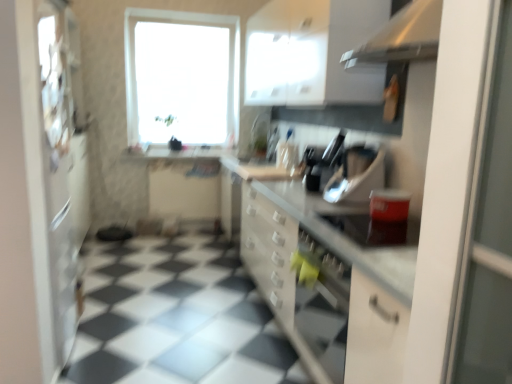
Locate an element on the screen. vacant space behind white matte refrigerator at left is located at coordinates (109, 316).